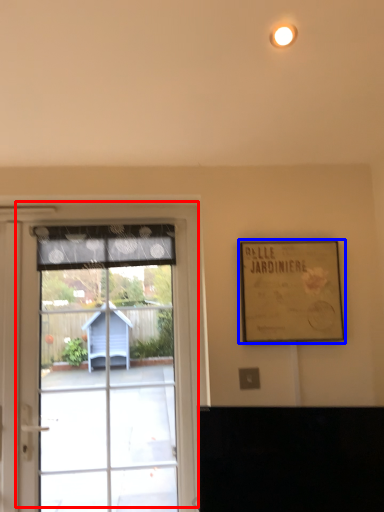
Question: Which object is further to the camera taking this photo, window (highlighted by a red box) or picture frame (highlighted by a blue box)?

Choices:
 (A) window
 (B) picture frame

Answer: (A)